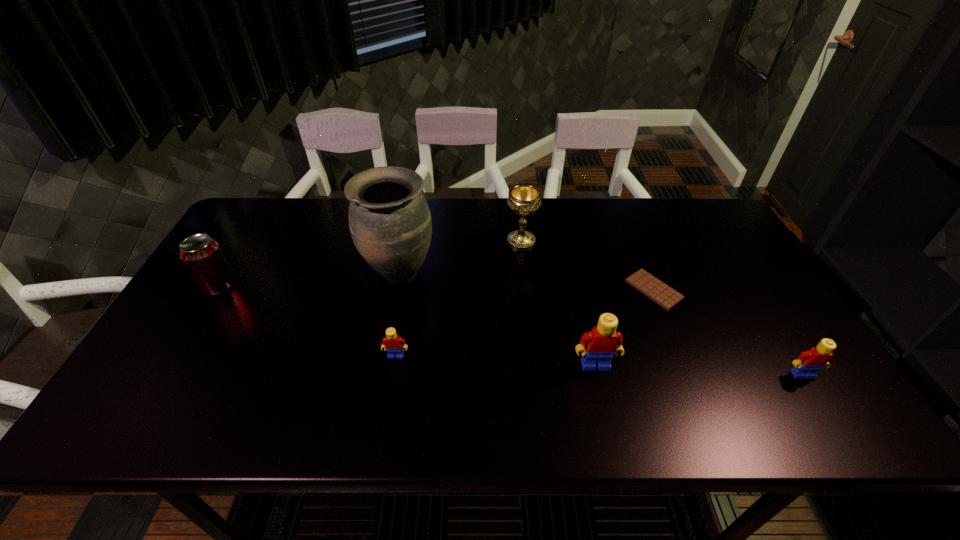
You are a GUI agent. You are given a task and a screenshot of the screen. Output one action in this format:
    pyautogui.click(x=<x>, y=<y>)
    Task: Click on the vacant area between the rightmost object and the second Lego from right to left
    This screenshot has height=540, width=960.
    Given the screenshot: What is the action you would take?
    pyautogui.click(x=699, y=370)

You are a GUI agent. You are given a task and a screenshot of the screen. Output one action in this format:
    pyautogui.click(x=<x>, y=<y>)
    Task: Click on the vacant space in between the urn and the soda can
    Image resolution: width=960 pixels, height=540 pixels.
    Given the screenshot: What is the action you would take?
    pyautogui.click(x=309, y=279)

Choose which object is the fourth nearest neighbor to the tallest object. Please provide its 2D coordinates. Your answer should be formatted as a tuple, i.e. [(x, y)], where the tuple contains the x and y coordinates of a point satisfying the conditions above.

[(603, 341)]

I want to click on the third closest object to the rightmost Lego, so click(x=524, y=199).

Locate an element on the screen. This screenshot has width=960, height=540. the second closest Lego to the tallest Lego is located at coordinates (392, 342).

Point out which Lego is positioned as the nearest to the second Lego from right to left. Please provide its 2D coordinates. Your answer should be formatted as a tuple, i.e. [(x, y)], where the tuple contains the x and y coordinates of a point satisfying the conditions above.

[(809, 362)]

Find the location of a particular element. vacant space that satisfies the following two spatial constraints: 1. on the back side of the tallest object; 2. on the left side of the soda can is located at coordinates (227, 273).